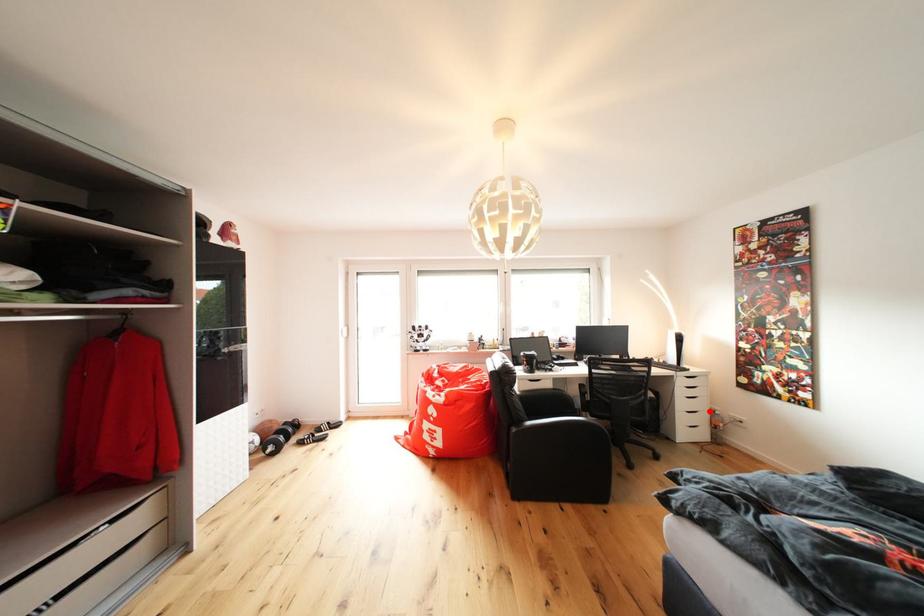
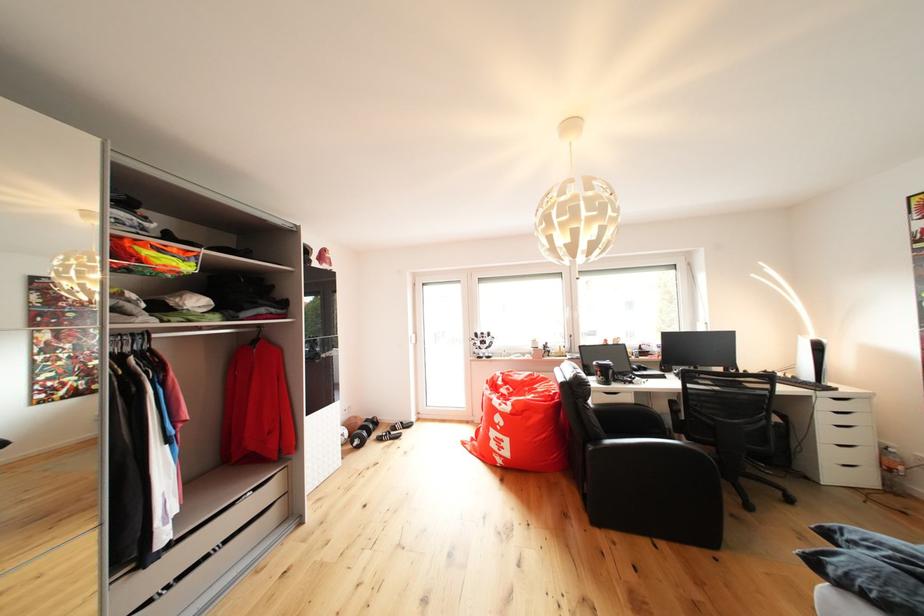
Locate, in the second image, the point that corresponds to the highlighted location in the first image.

(869, 444)